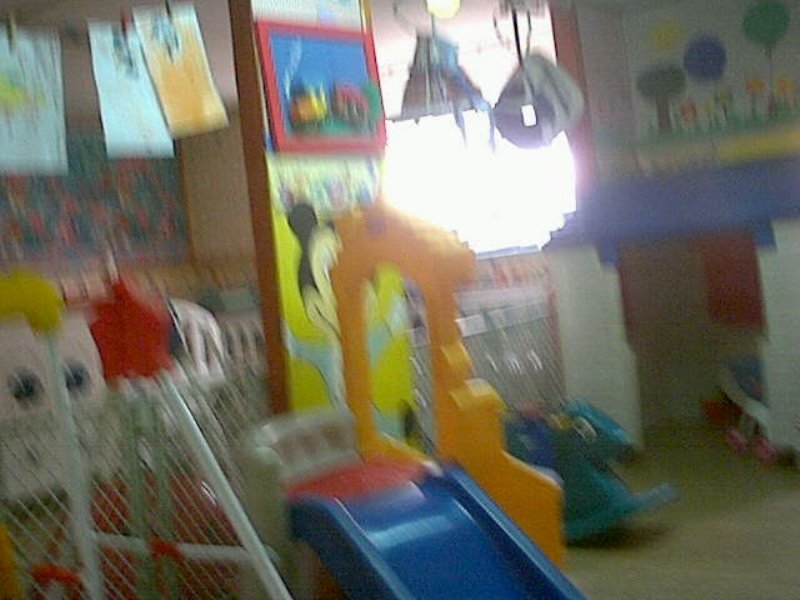
Find the location of a particular element. Image resolution: width=800 pixels, height=600 pixels. these drawings likely hang from string or wire is located at coordinates (26, 47), (114, 55), (178, 48).